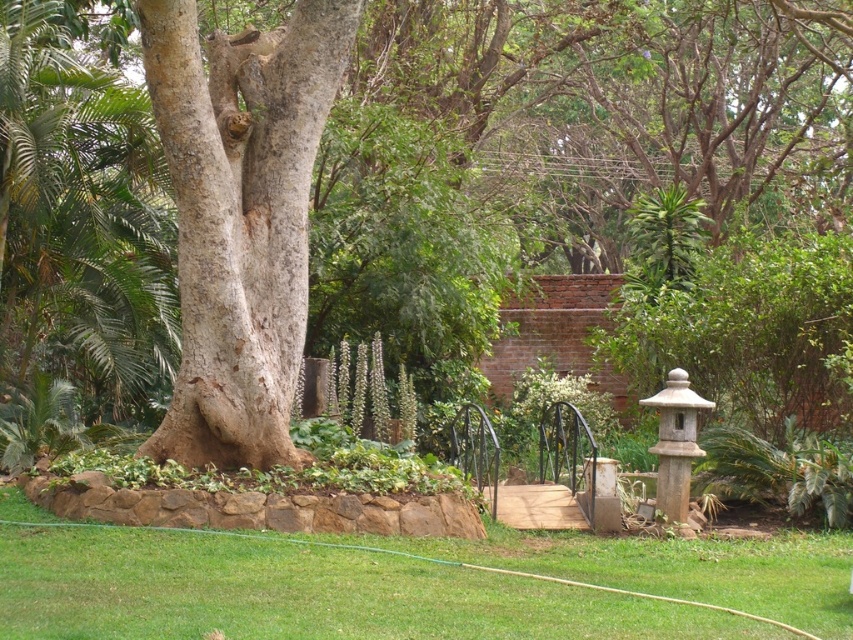
Which is below, green grass at lower center or smooth gray bark at center?

green grass at lower center is lower down.

Who is more forward, (779, 579) or (287, 195)?

Point (779, 579) is more forward.

Locate an element on the screen. Image resolution: width=853 pixels, height=640 pixels. green grass at lower center is located at coordinates (412, 586).

How far apart are rough bark tree at center and smooth gray bark at center?

A distance of 19.72 feet exists between rough bark tree at center and smooth gray bark at center.

Between rough bark tree at center and smooth gray bark at center, which one is positioned lower?

smooth gray bark at center

Who is more forward, (677, 150) or (192, 342)?

Point (192, 342) is in front.

Locate an element on the screen. rough bark tree at center is located at coordinates (596, 86).

Can you confirm if rough bark tree at center is taller than green grass at lower center?

Yes.

Does rough bark tree at center have a lesser height compared to green grass at lower center?

Incorrect, rough bark tree at center's height does not fall short of green grass at lower center's.

At what (x,y) coordinates should I click in order to perform the action: click on rough bark tree at center. Please return your answer as a coordinate pair (x, y). The image size is (853, 640). Looking at the image, I should click on (596, 86).